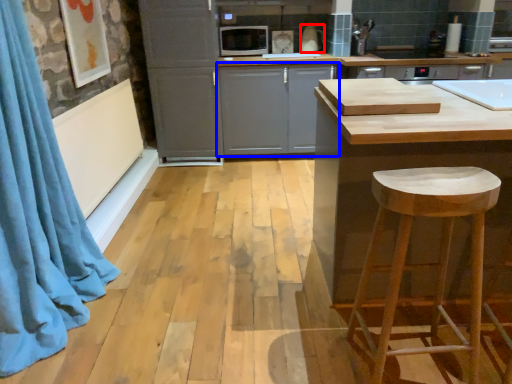
Question: Which point is closer to the camera, appliance (highlighted by a red box) or cabinetry (highlighted by a blue box)?

Choices:
 (A) appliance
 (B) cabinetry

Answer: (B)